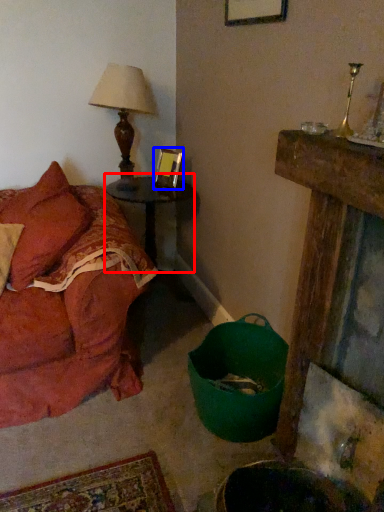
Question: Among these objects, which one is nearest to the camera, table (highlighted by a red box) or picture frame (highlighted by a blue box)?

Choices:
 (A) table
 (B) picture frame

Answer: (A)